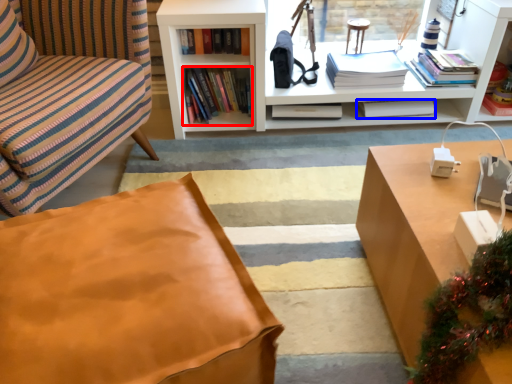
Question: Among these objects, which one is nearest to the camera, book (highlighted by a red box) or book (highlighted by a blue box)?

Choices:
 (A) book
 (B) book

Answer: (A)